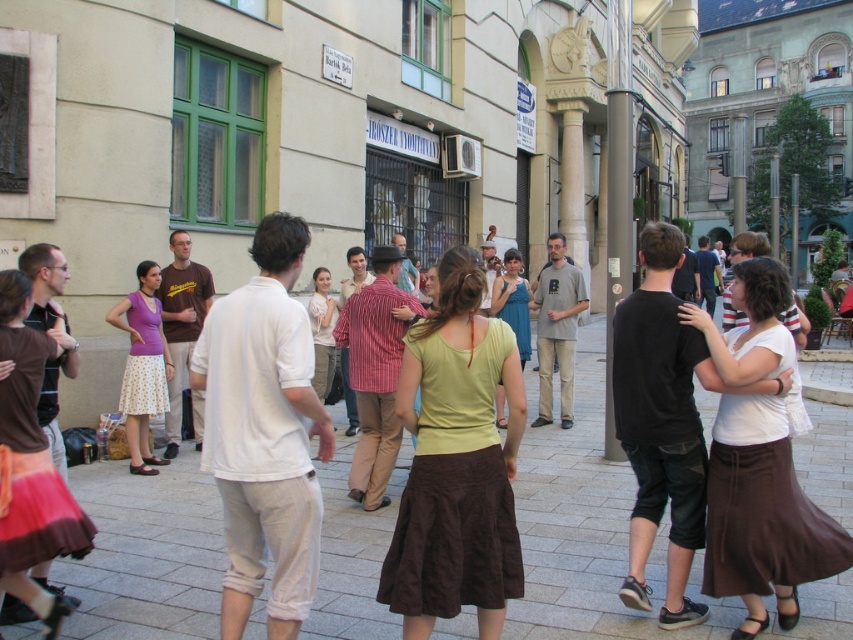
You are a photographer at the event and need to capture a photo of the dancers. The brown fabric skirt at center and the white cotton shirt at center are both in the frame. Which one do you think will appear smaller in the photo?

The brown fabric skirt at center is smaller than the white cotton shirt at center, so it will appear smaller in the photo.

You are a photographer trying to capture the dancer wearing the brown fabric skirt at center and the person in the matte purple tank top at left. Which clothing item should you focus on if you want to photograph the smaller one?

The brown fabric skirt at center is smaller than the matte purple tank top at left, so you should focus on the brown fabric skirt at center to photograph the smaller one.